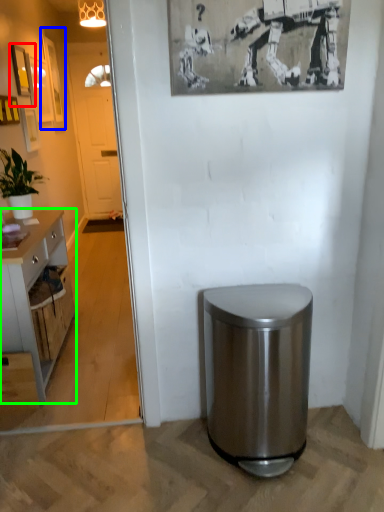
Question: Estimate the real-world distances between objects in this image. Which object is closer to picture frame (highlighted by a red box), picture frame (highlighted by a blue box) or cabinetry (highlighted by a green box)?

Choices:
 (A) picture frame
 (B) cabinetry

Answer: (A)